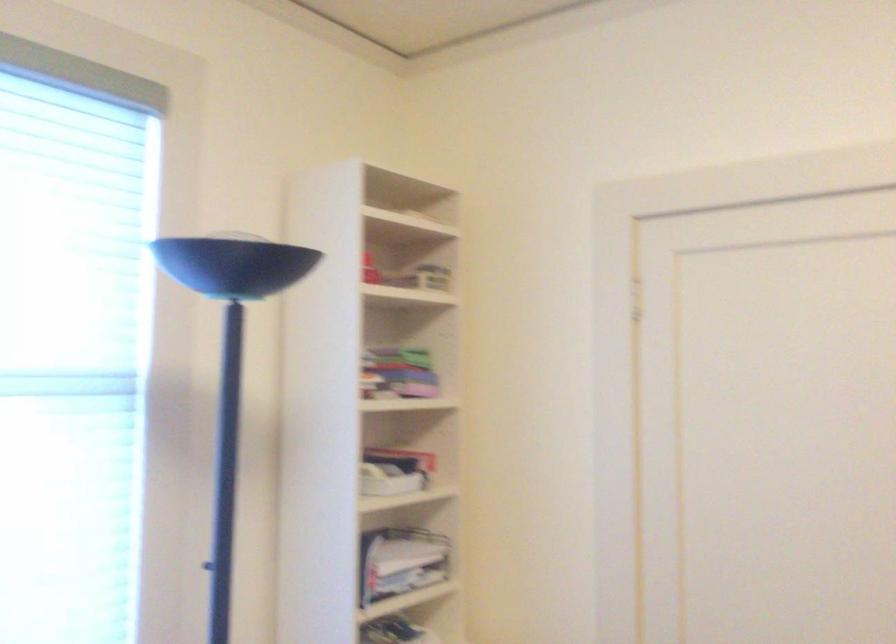
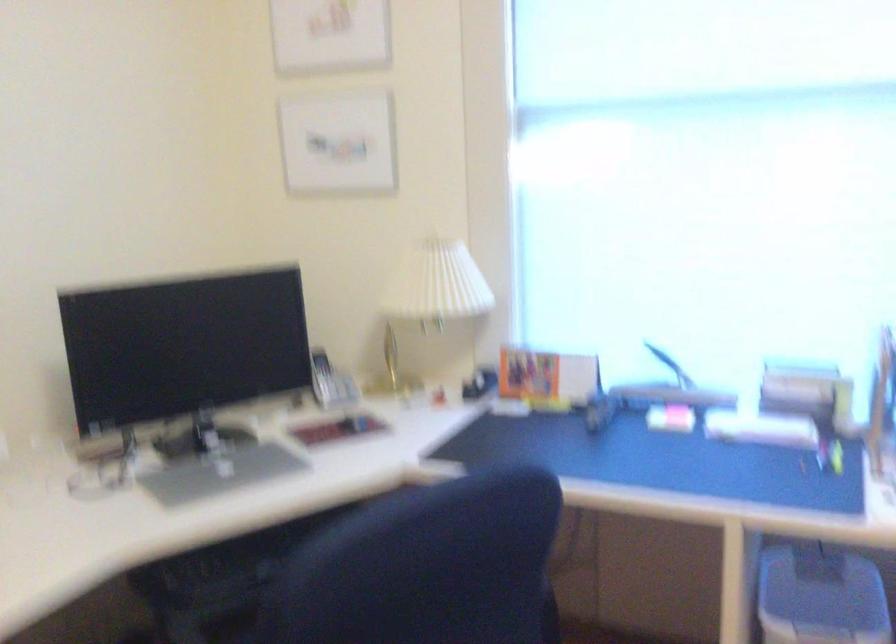
Question: The first image is from the beginning of the video and the second image is from the end. How did the camera likely rotate when shooting the video?

Choices:
 (A) Left
 (B) Right
 (C) Up
 (D) Down

Answer: (A)